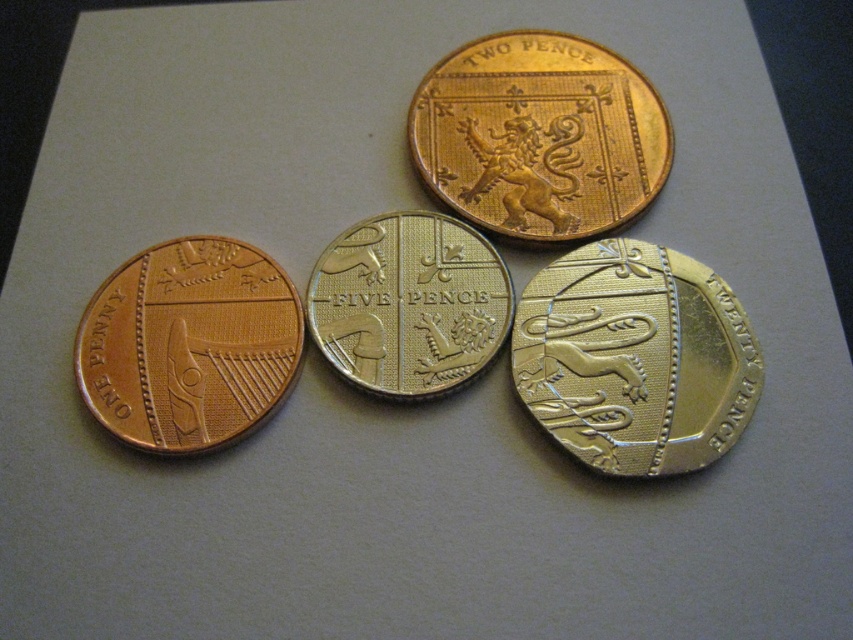
Can you confirm if gold metallic twenty pence at center is bigger than silver/golden metallic five pence at center?

Indeed, gold metallic twenty pence at center has a larger size compared to silver/golden metallic five pence at center.

Identify the location of gold metallic twenty pence at center. The width and height of the screenshot is (853, 640). (635, 358).

Does gold shiny two pence at upper center have a lesser width compared to matte copper coin at lower left?

No, gold shiny two pence at upper center is not thinner than matte copper coin at lower left.

Is point (461, 138) in front of point (212, 307)?

No, (461, 138) is behind (212, 307).

Find the location of `gold shiny two pence at upper center`. gold shiny two pence at upper center is located at coordinates (538, 134).

Who is more forward, (521, 86) or (334, 317)?

Point (334, 317) is more forward.

Is gold shiny two pence at upper center above silver/golden metallic five pence at center?

Yes, gold shiny two pence at upper center is above silver/golden metallic five pence at center.

Who is more forward, (582, 200) or (440, 355)?

Positioned in front is point (440, 355).

This screenshot has width=853, height=640. Find the location of `gold shiny two pence at upper center`. gold shiny two pence at upper center is located at coordinates (538, 134).